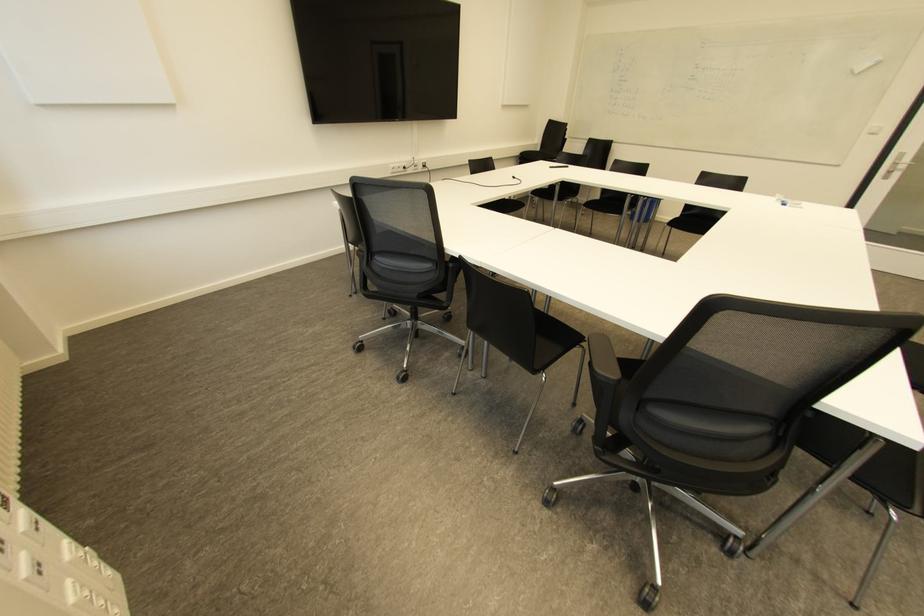
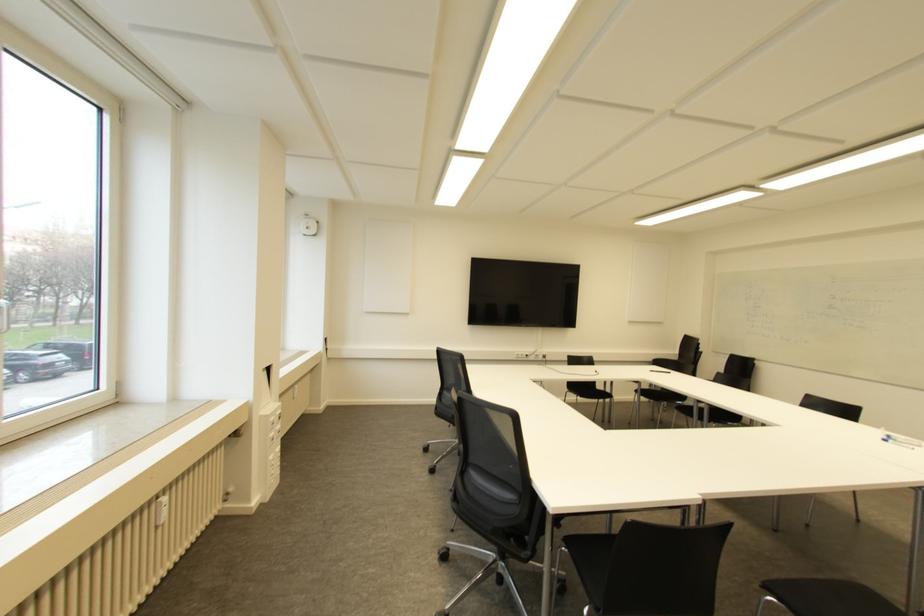
In the second image, find the point that corresponds to (423,166) in the first image.

(543, 355)